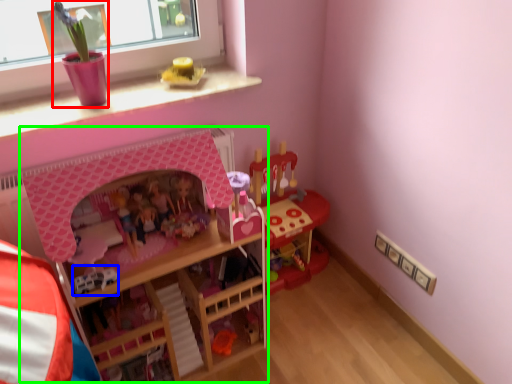
Question: Considering the real-world distances, which object is farthest from toy (highlighted by a red box)? toy (highlighted by a blue box) or bunk bed (highlighted by a green box)?

Choices:
 (A) toy
 (B) bunk bed

Answer: (A)